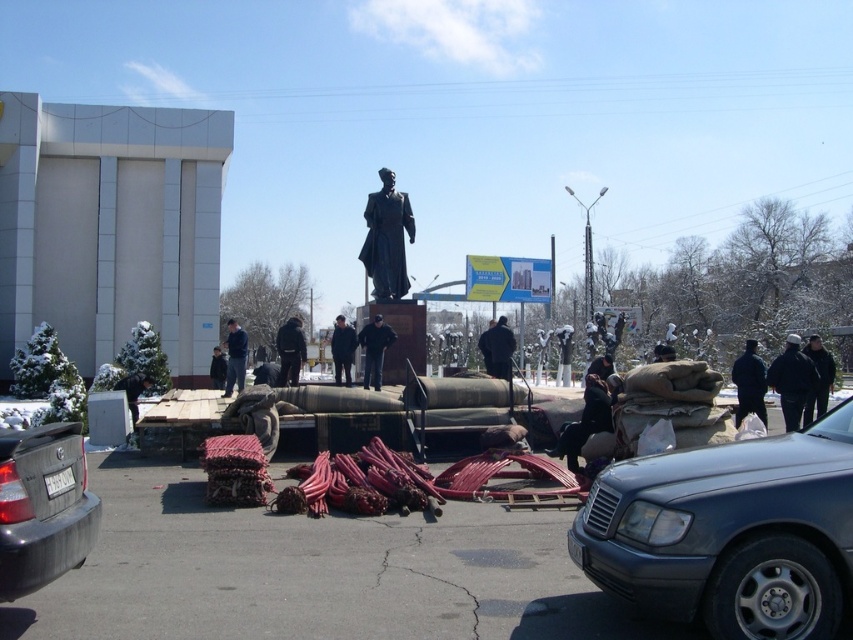
Which is below, black matte pants at center or black fabric jacket at center?

Positioned lower is black fabric jacket at center.

Is black matte pants at center wider than black fabric jacket at center?

Correct, the width of black matte pants at center exceeds that of black fabric jacket at center.

Between point (363, 385) and point (223, 364), which one is positioned behind?

Positioned behind is point (223, 364).

I want to click on black matte pants at center, so click(x=374, y=349).

Which is more to the left, black matte coat at center or black matte jacket at center?

Positioned to the left is black matte jacket at center.

Can you confirm if black matte coat at center is thinner than black matte jacket at center?

Indeed, black matte coat at center has a lesser width compared to black matte jacket at center.

What do you see at coordinates (497, 348) in the screenshot?
I see `black matte coat at center` at bounding box center [497, 348].

The height and width of the screenshot is (640, 853). What are the coordinates of `black matte coat at center` in the screenshot? It's located at (497, 348).

How distant is matte black car at lower left from dark blue jacket at center?

matte black car at lower left and dark blue jacket at center are 12.97 meters apart.

Based on the photo, between matte black car at lower left and dark blue jacket at center, which one is positioned lower?

matte black car at lower left is below.

Is point (0, 563) positioned behind point (334, 358)?

No, it is not.

Locate an element on the screen. matte black car at lower left is located at coordinates (44, 506).